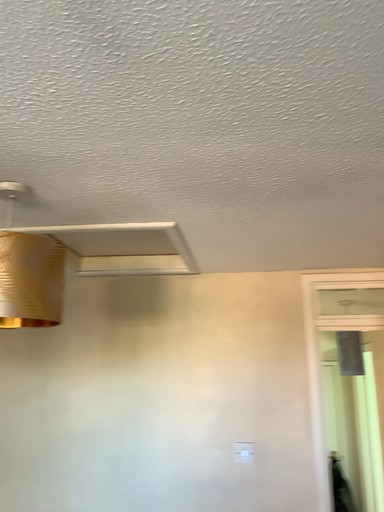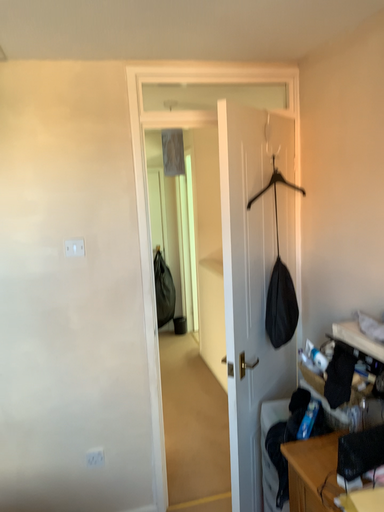
Question: Which way did the camera rotate in the video?

Choices:
 (A) rotated right
 (B) rotated left

Answer: (A)